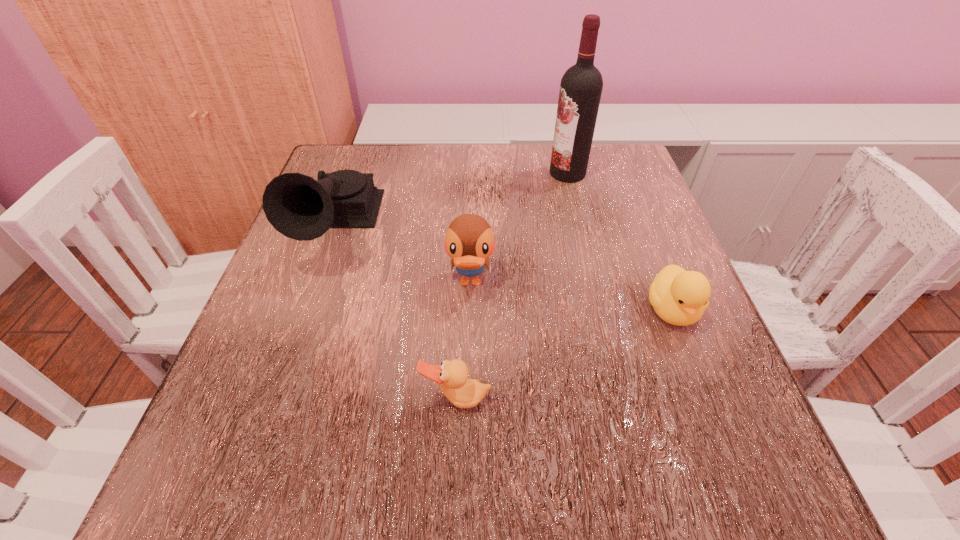
This screenshot has width=960, height=540. In order to click on duck that is at the right edge in this screenshot , I will do click(x=679, y=297).

You are a GUI agent. You are given a task and a screenshot of the screen. Output one action in this format:
    pyautogui.click(x=<x>, y=<y>)
    Task: Click on the object situated at the far left corner
    This screenshot has height=540, width=960.
    Given the screenshot: What is the action you would take?
    pyautogui.click(x=299, y=207)

Where is `object located in the far right corner section of the desktop`? The width and height of the screenshot is (960, 540). object located in the far right corner section of the desktop is located at coordinates (581, 86).

This screenshot has width=960, height=540. Find the location of `vacant space at the far edge of the desktop`. vacant space at the far edge of the desktop is located at coordinates (528, 159).

You are a GUI agent. You are given a task and a screenshot of the screen. Output one action in this format:
    pyautogui.click(x=<x>, y=<y>)
    Task: Click on the vacant space at the near edge of the desktop
    This screenshot has width=960, height=540.
    Given the screenshot: What is the action you would take?
    pyautogui.click(x=321, y=492)

This screenshot has width=960, height=540. I want to click on vacant space at the left edge of the desktop, so click(x=248, y=432).

Find the location of a particular element. free location at the right edge is located at coordinates (607, 321).

In the image, there is a desktop. At what (x,y) coordinates should I click in order to perform the action: click on vacant space at the far left corner. Please return your answer as a coordinate pair (x, y). Looking at the image, I should click on (377, 164).

Find the location of a particular element. This screenshot has height=540, width=960. blank area at the near left corner is located at coordinates (207, 464).

Find the location of a particular element. free space at the far right corner is located at coordinates click(x=614, y=181).